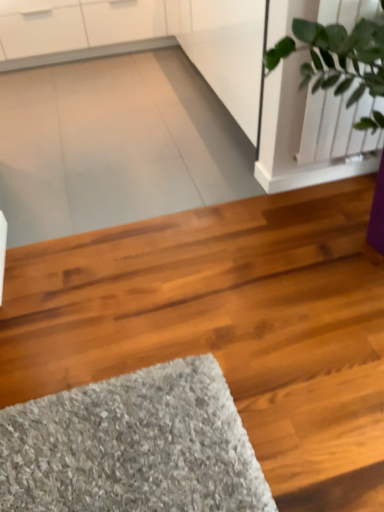
What do you see at coordinates (321, 104) in the screenshot?
I see `green leafy plant at upper right` at bounding box center [321, 104].

This screenshot has width=384, height=512. In order to click on green leafy plant at upper right in this screenshot , I will do `click(321, 104)`.

What do you see at coordinates (226, 326) in the screenshot?
I see `shiny brown hardwood at center` at bounding box center [226, 326].

Where is `shiny brown hardwood at center`? This screenshot has width=384, height=512. shiny brown hardwood at center is located at coordinates (226, 326).

Where is `green leafy plant at upper right`? green leafy plant at upper right is located at coordinates (321, 104).

Based on their positions, is shiny brown hardwood at center located to the left or right of green leafy plant at upper right?

shiny brown hardwood at center is to the left of green leafy plant at upper right.

Which object is further away from the camera, shiny brown hardwood at center or green leafy plant at upper right?

green leafy plant at upper right is behind.

Which is less distant, (274, 313) or (312, 39)?

The point (312, 39) is closer to the camera.

From the image's perspective, which is above, shiny brown hardwood at center or green leafy plant at upper right?

From the image's view, green leafy plant at upper right is above.

From a real-world perspective, who is located lower, shiny brown hardwood at center or green leafy plant at upper right?

shiny brown hardwood at center is physically lower.

In terms of width, does shiny brown hardwood at center look wider or thinner when compared to green leafy plant at upper right?

shiny brown hardwood at center is wider than green leafy plant at upper right.

From the picture: Considering the sizes of objects shiny brown hardwood at center and green leafy plant at upper right in the image provided, who is shorter, shiny brown hardwood at center or green leafy plant at upper right?

shiny brown hardwood at center is shorter.

Is shiny brown hardwood at center smaller than green leafy plant at upper right?

Actually, shiny brown hardwood at center might be larger than green leafy plant at upper right.

Is shiny brown hardwood at center not within green leafy plant at upper right?

Absolutely, shiny brown hardwood at center is external to green leafy plant at upper right.

Is shiny brown hardwood at center touching green leafy plant at upper right?

No, shiny brown hardwood at center is not beside green leafy plant at upper right.

Is shiny brown hardwood at center oriented away from green leafy plant at upper right?

shiny brown hardwood at center does not have its back to green leafy plant at upper right.

Identify the location of houseplant on the right of the shiny brown hardwood at center. This screenshot has height=512, width=384. (321, 104).

Considering the relative positions of green leafy plant at upper right and shiny brown hardwood at center in the image provided, is green leafy plant at upper right to the right of shiny brown hardwood at center from the viewer's perspective?

Correct, you'll find green leafy plant at upper right to the right of shiny brown hardwood at center.

Which is in front, green leafy plant at upper right or shiny brown hardwood at center?

shiny brown hardwood at center is in front.

Between point (297, 63) and point (282, 306), which one is positioned in front?

The point (282, 306) is closer to the camera.

From the image's perspective, which object appears higher, green leafy plant at upper right or shiny brown hardwood at center?

green leafy plant at upper right.

From a real-world perspective, is green leafy plant at upper right physically located above or below shiny brown hardwood at center?

green leafy plant at upper right is above shiny brown hardwood at center.

Is green leafy plant at upper right thinner than shiny brown hardwood at center?

→ Yes, green leafy plant at upper right is thinner than shiny brown hardwood at center.

In terms of height, does green leafy plant at upper right look taller or shorter compared to shiny brown hardwood at center?

In the image, green leafy plant at upper right appears to be taller than shiny brown hardwood at center.

Who is smaller, green leafy plant at upper right or shiny brown hardwood at center?

green leafy plant at upper right is smaller.

Which is correct: green leafy plant at upper right is inside shiny brown hardwood at center, or outside of it?

green leafy plant at upper right is outside shiny brown hardwood at center.

Is green leafy plant at upper right not near shiny brown hardwood at center?

No.

In the scene shown: Is green leafy plant at upper right looking in the opposite direction of shiny brown hardwood at center?

That's not correct — green leafy plant at upper right is not looking away from shiny brown hardwood at center.

Can you tell me how much green leafy plant at upper right and shiny brown hardwood at center differ in facing direction?

The angle between the facing direction of green leafy plant at upper right and the facing direction of shiny brown hardwood at center is 89.6 degrees.

Measure the distance from green leafy plant at upper right to shiny brown hardwood at center.

They are 23.75 inches apart.

I want to click on hardwood on the left of green leafy plant at upper right, so click(226, 326).

The image size is (384, 512). I want to click on houseplant above the shiny brown hardwood at center (from a real-world perspective), so click(321, 104).

This screenshot has width=384, height=512. What are the coordinates of `hardwood below the green leafy plant at upper right (from the image's perspective)` in the screenshot? It's located at (226, 326).